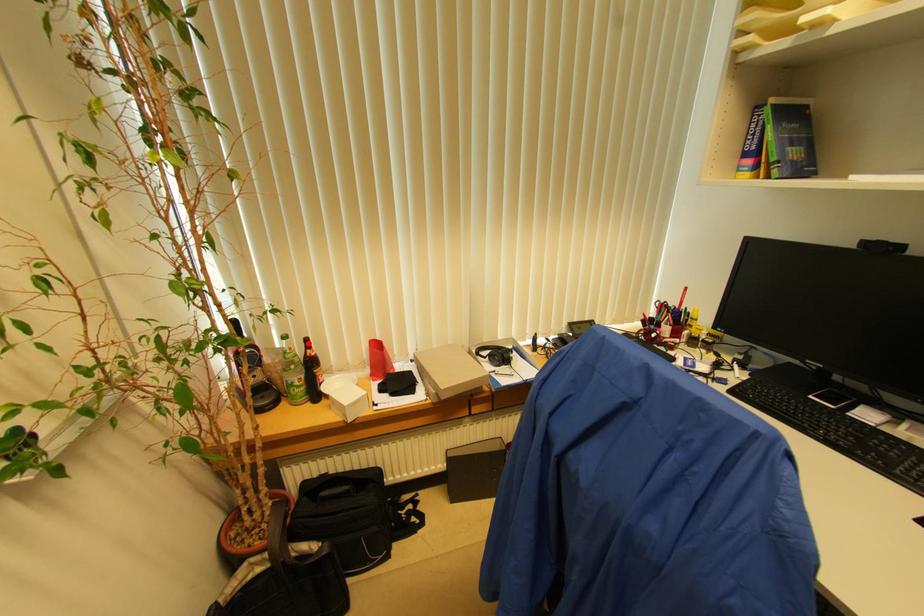
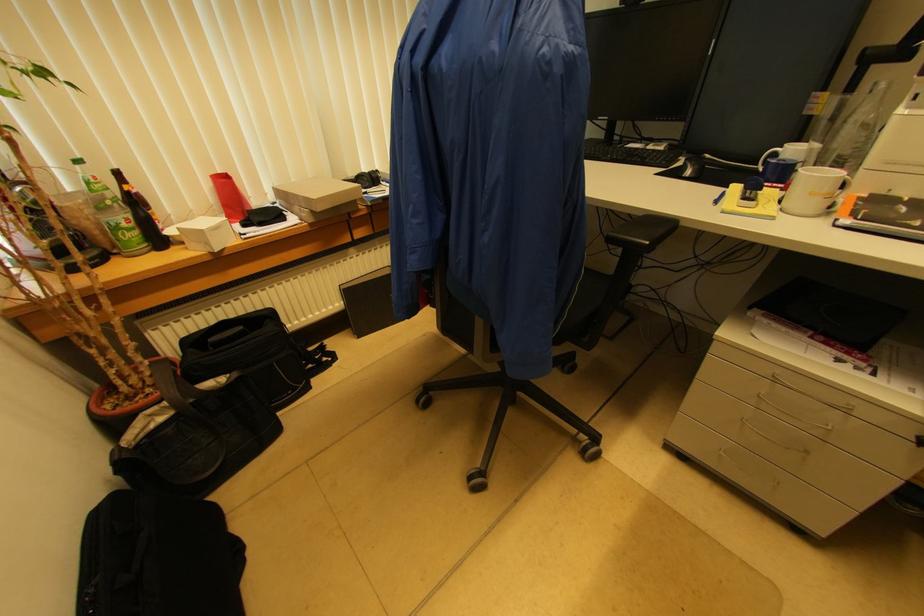
The point at the highlighted location is marked in the first image. Where is the corresponding point in the second image?

(118, 176)